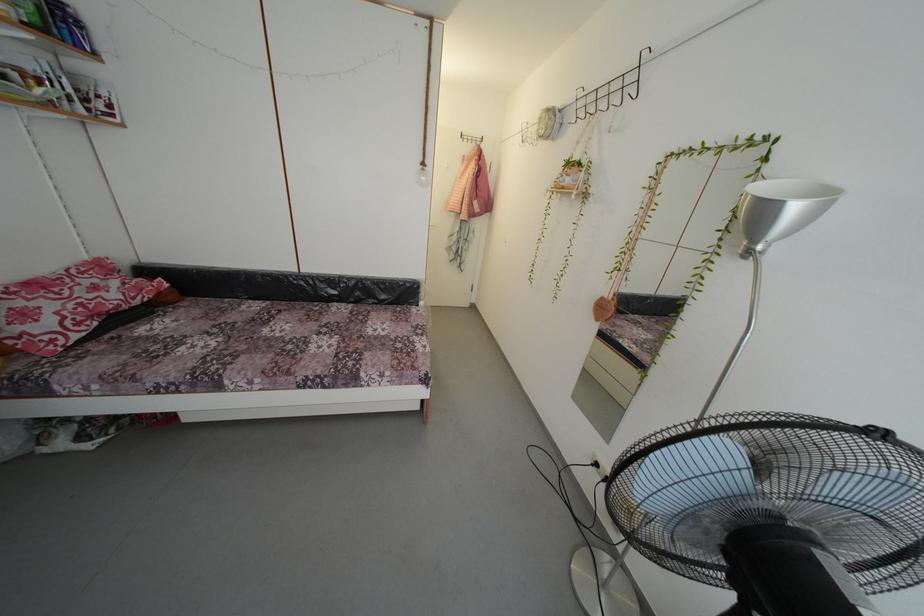
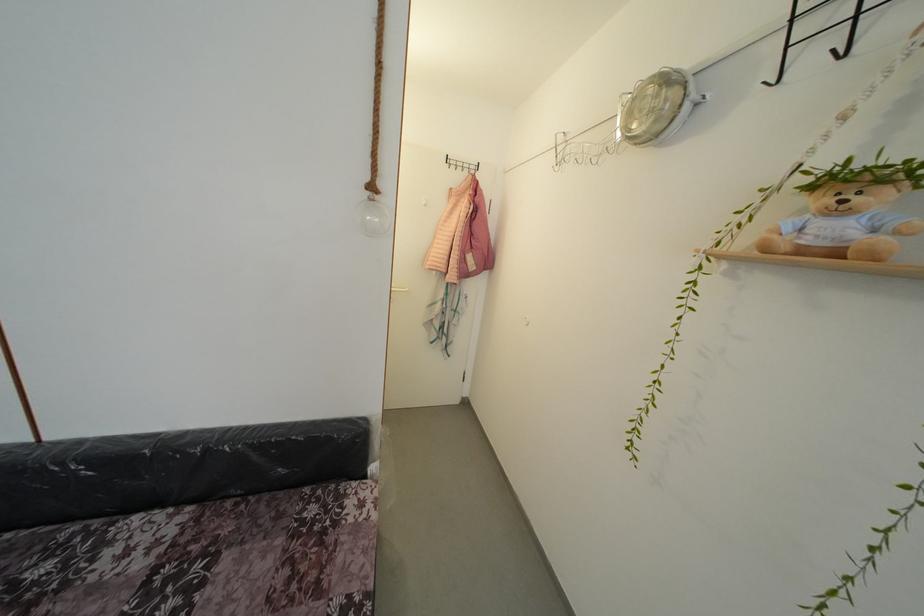
Locate, in the second image, the point that corresponds to point (573, 187) in the first image.

(841, 236)